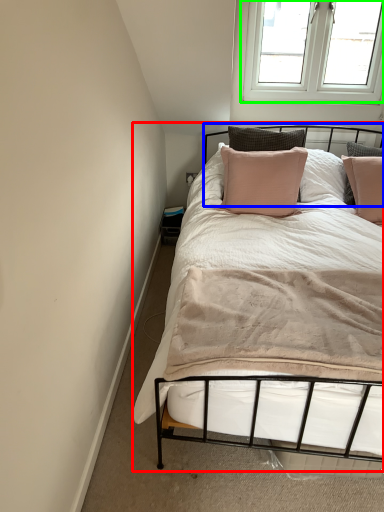
Question: Based on their relative distances, which object is nearer to bed (highlighted by a red box)? Choose from headboard (highlighted by a blue box) and window (highlighted by a green box).

Choices:
 (A) headboard
 (B) window

Answer: (B)